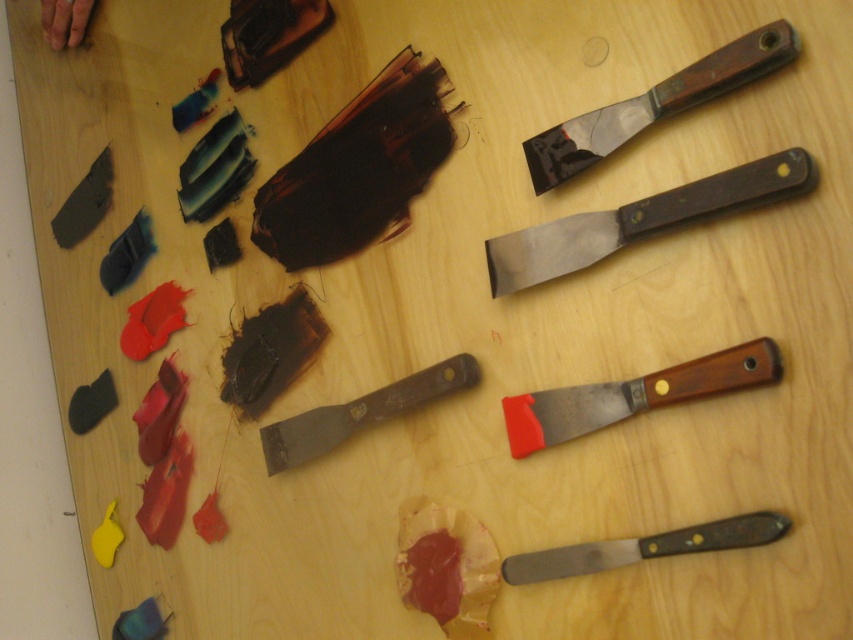
Question: Can you confirm if wooden-handled putty knife at center is bigger than metallic silver knife at bottom right?

Choices:
 (A) no
 (B) yes

Answer: (B)

Question: Which is nearer to the wooden-handled putty knife at upper right?

Choices:
 (A) wooden-handled putty knife at center
 (B) wooden-handled spatula at center-right

Answer: (B)

Question: From the image, what is the correct spatial relationship of wooden-handled putty knife at upper right in relation to wooden-handled spatula at upper right?

Choices:
 (A) above
 (B) below

Answer: (B)

Question: Which object appears farthest from the camera in this image?

Choices:
 (A) metallic silver knife at bottom right
 (B) wooden-handled spatula at center-right
 (C) wooden-handled spatula at upper right
 (D) wooden-handled putty knife at upper right

Answer: (B)

Question: Can you confirm if wooden-handled putty knife at upper right is positioned to the left of wooden-handled spatula at center-right?

Choices:
 (A) yes
 (B) no

Answer: (B)

Question: Which is farther from the wooden-handled spatula at center-right?

Choices:
 (A) wooden-handled putty knife at upper right
 (B) wooden-handled spatula at upper right

Answer: (B)